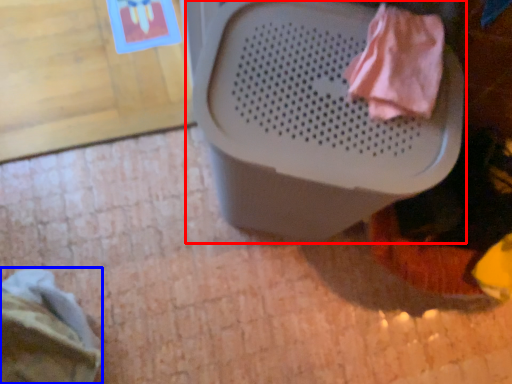
Question: Which object is further to the camera taking this photo, waste container (highlighted by a red box) or clothing (highlighted by a blue box)?

Choices:
 (A) waste container
 (B) clothing

Answer: (B)